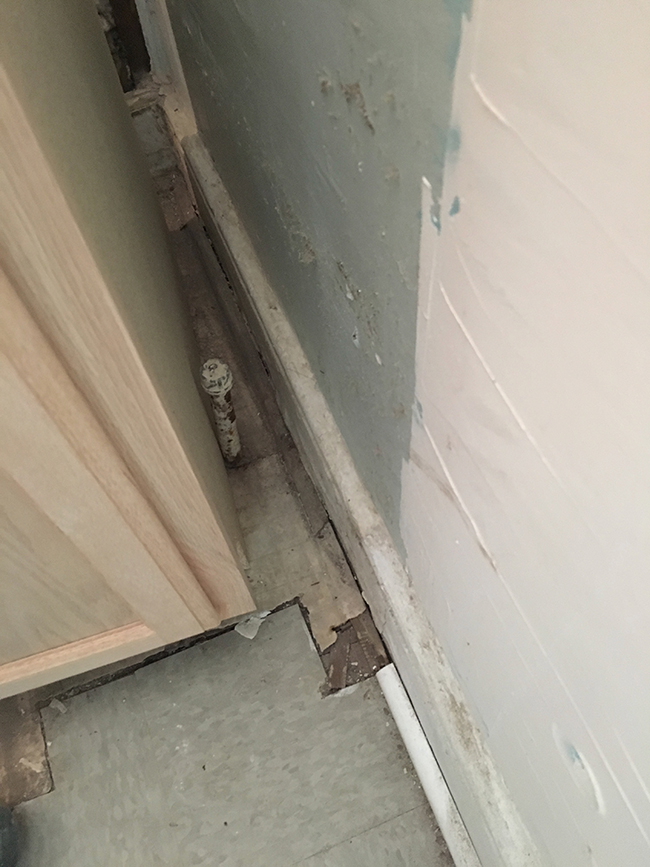
Where is `right side of cabinet`? This screenshot has width=650, height=867. right side of cabinet is located at coordinates (133, 272).